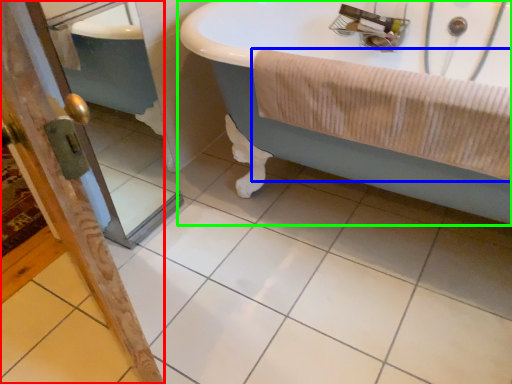
Question: Which object is positioned farthest from screen door (highlighted by a red box)? Select from bath towel (highlighted by a blue box) and bathtub (highlighted by a green box).

Choices:
 (A) bath towel
 (B) bathtub

Answer: (B)